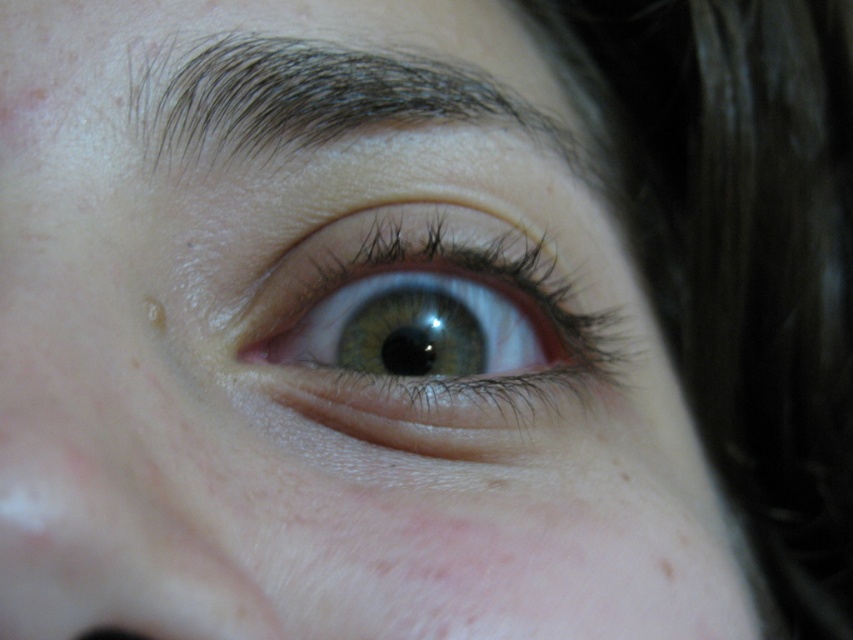
You are a photographer adjusting the focus on a camera. The subject has a green glossy eye at center marked by point (425, 326). You need to ensure the focus is on the pupil. Where should you adjust the focus point to? Please provide the coordinates in the format of point followed by the coordinate values.

The green glossy eye at center is represented by point (425, 326), so you should adjust the focus point to point (425, 326) to ensure the pupil is in focus.

You are a photographer adjusting your camera settings to capture the perfect shot of an eye. You want to ensure that the point at coordinates point (338, 355) is in sharp focus. Given that your camera has a depth of field of 12 inches, will this point be within the depth of field if the camera is focused on the center of the eye?

The distance of point (338, 355) from camera is 13.45 inches. Since the depth of field is 12 inches, the point is outside the depth of field, so it may not be in sharp focus unless the focus point is adjusted.